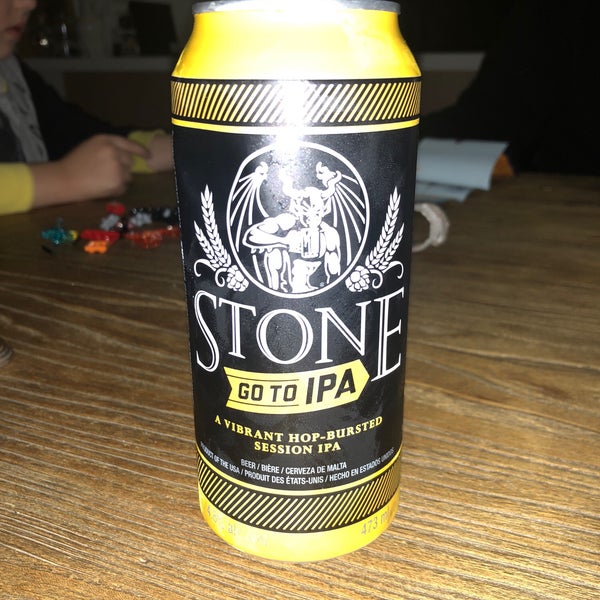
This screenshot has width=600, height=600. What are the coordinates of `table` in the screenshot? It's located at (498, 390).